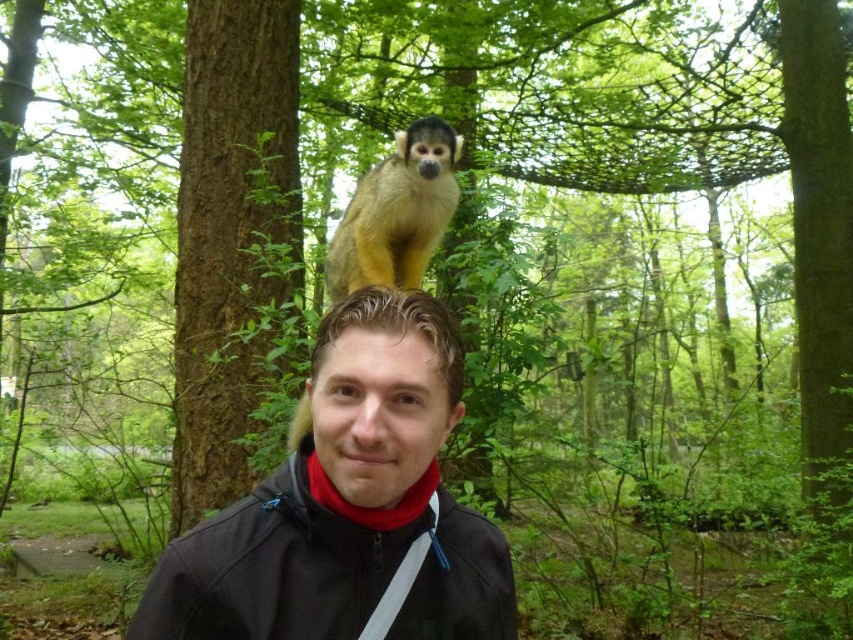
Which is more to the right, matte black head at center or golden fur monkey at upper center?

matte black head at center is more to the right.

Is point (433, 349) farther from camera compared to point (447, 145)?

No, it is not.

What do you see at coordinates (381, 392) in the screenshot? I see `matte black head at center` at bounding box center [381, 392].

Locate an element on the screen. This screenshot has height=640, width=853. matte black head at center is located at coordinates (381, 392).

Between matte black jacket at center and golden fur monkey at upper center, which one appears on the right side from the viewer's perspective?

From the viewer's perspective, matte black jacket at center appears more on the right side.

Who is more forward, (273, 472) or (431, 161)?

Positioned in front is point (273, 472).

This screenshot has height=640, width=853. What do you see at coordinates (347, 506) in the screenshot?
I see `matte black jacket at center` at bounding box center [347, 506].

At what (x,y) coordinates should I click in order to perform the action: click on matte black jacket at center. Please return your answer as a coordinate pair (x, y). The width and height of the screenshot is (853, 640). Looking at the image, I should click on (347, 506).

Who is lower down, matte black jacket at center or matte black head at center?

Positioned lower is matte black jacket at center.

Which is more to the right, matte black jacket at center or matte black head at center?

matte black jacket at center is more to the right.

Describe the element at coordinates (347, 506) in the screenshot. I see `matte black jacket at center` at that location.

Image resolution: width=853 pixels, height=640 pixels. Find the location of `matte black jacket at center`. matte black jacket at center is located at coordinates (347, 506).